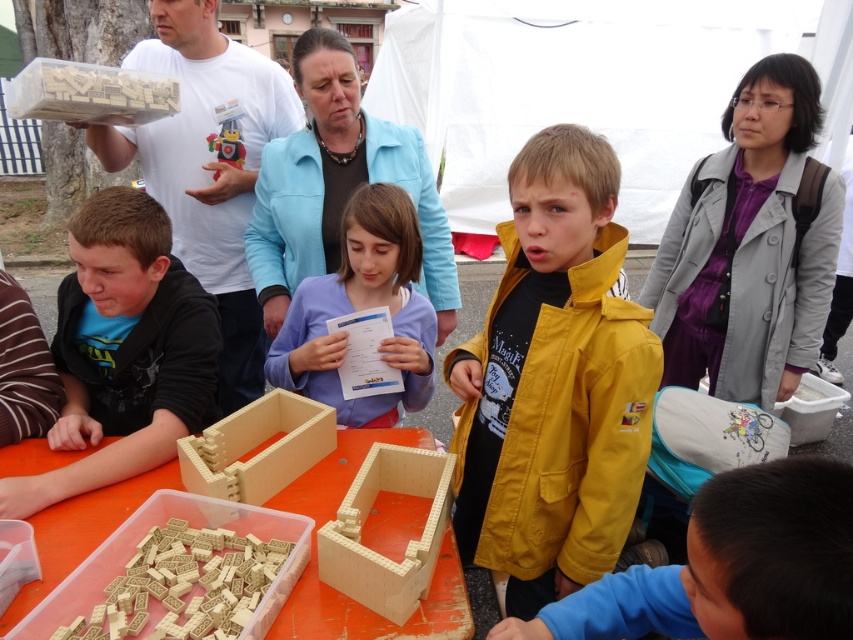
What are the coordinates of the yellow matte jacket at center?

The yellow matte jacket at center is located at coordinates point [554,381].

You are a participant in the building activity and need to place a new wooden block on the table. Which object, the wooden blocks at lower left or the wooden block at center, is closer to you if you are standing at the front of the table?

The wooden blocks at lower left is closer to you because it is in front of the wooden block at center.

In the scene shown: You are organizing a space for a building activity and need to ensure there is enough room for all participants. The yellow matte jacket at center and the matte black hoodie at left are both on the table. Which of these two items takes up more space on the table?

The yellow matte jacket at center takes up more space on the table because it is bigger than the matte black hoodie at left.